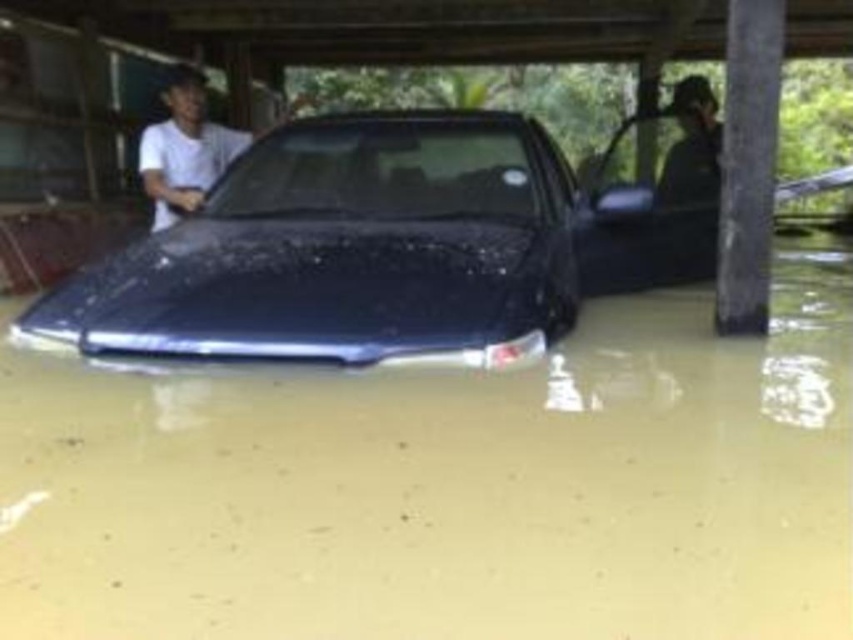
Is point (782, 385) closer to viewer compared to point (223, 168)?

Yes, point (782, 385) is closer to viewer.

Can you confirm if clear water at car front is positioned to the right of white matte shirt at center?

Correct, you'll find clear water at car front to the right of white matte shirt at center.

What do you see at coordinates (450, 484) in the screenshot? This screenshot has height=640, width=853. I see `clear water at car front` at bounding box center [450, 484].

Where is `clear water at car front`? This screenshot has width=853, height=640. clear water at car front is located at coordinates (450, 484).